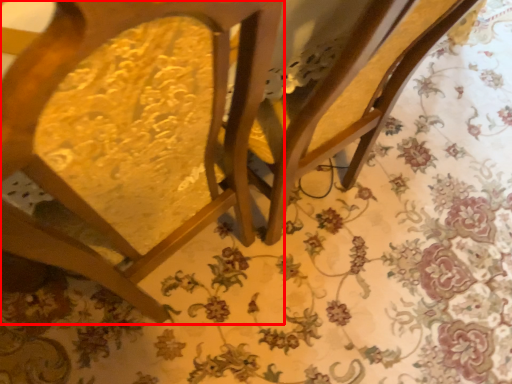
Question: From the image's perspective, what is the correct spatial positioning of chair (annotated by the red box) in reference to swivel chair?

Choices:
 (A) below
 (B) above

Answer: (A)